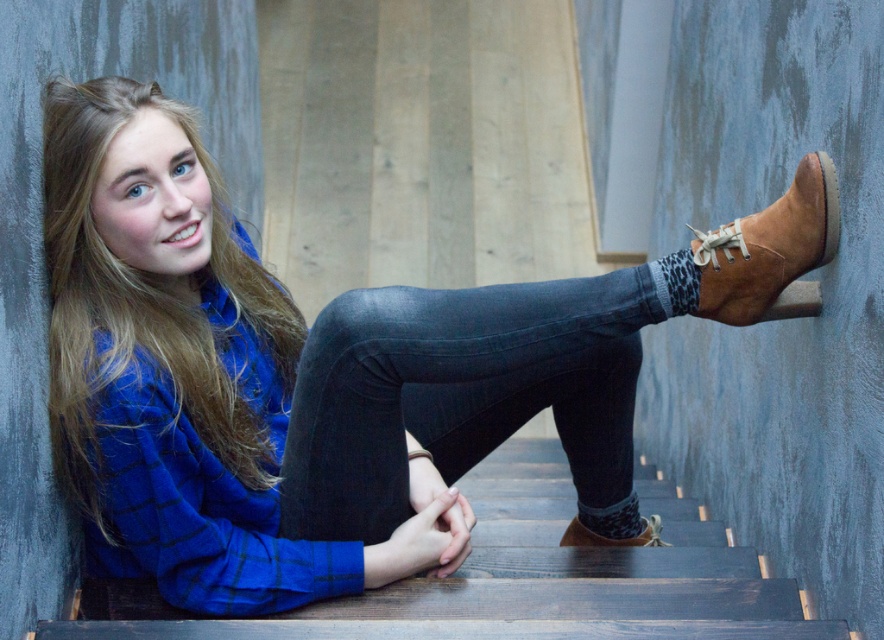
Is point (711, 262) farther from viewer compared to point (588, 545)?

No, (711, 262) is in front of (588, 545).

Does brown suede boot at upper right have a lesser width compared to leather boot at lower center?

Incorrect, brown suede boot at upper right's width is not less than leather boot at lower center's.

Between point (799, 168) and point (580, 534), which one is positioned in front?

Point (799, 168)

Locate an element on the screen. brown suede boot at upper right is located at coordinates (768, 250).

Does dark wood stairs at center have a lesser width compared to leather boot at lower center?

No.

Is dark wood stairs at center in front of leather boot at lower center?

Yes, it is in front of leather boot at lower center.

Identify the location of dark wood stairs at center. (517, 579).

Is dark gray denim jeans at center smaller than dark wood stairs at center?

Correct, dark gray denim jeans at center occupies less space than dark wood stairs at center.

In the scene shown: Does dark gray denim jeans at center have a lesser height compared to dark wood stairs at center?

In fact, dark gray denim jeans at center may be taller than dark wood stairs at center.

Between point (413, 333) and point (522, 616), which one is positioned behind?

The point (522, 616) is behind.

What are the coordinates of `dark gray denim jeans at center` in the screenshot? It's located at 463,394.